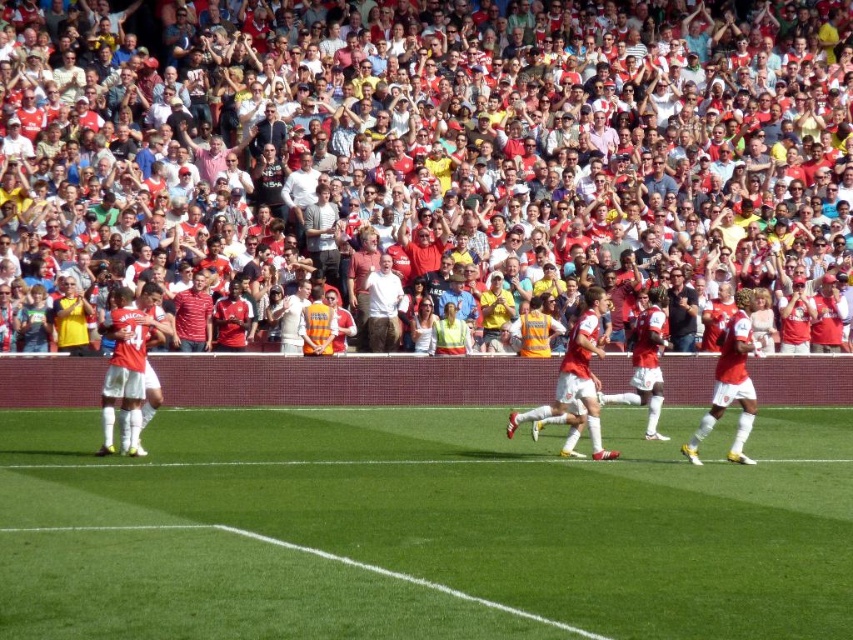
Question: Where is red jersey fans at center located in relation to matte red jersey at right in the image?

Choices:
 (A) right
 (B) left

Answer: (B)

Question: Which object is closer to the camera taking this photo?

Choices:
 (A) matte red jersey at right
 (B) green grass at center
 (C) red jersey fans at center

Answer: (B)

Question: Does red jersey fans at center have a greater width compared to green grass at center?

Choices:
 (A) no
 (B) yes

Answer: (B)

Question: Which object is positioned closest to the green grass at center?

Choices:
 (A) matte red jersey at right
 (B) red jersey fans at center

Answer: (A)

Question: Which object is positioned closest to the matte red jersey at right?

Choices:
 (A) red jersey fans at center
 (B) green grass at center

Answer: (B)

Question: Is green grass at center bigger than matte red jersey at right?

Choices:
 (A) yes
 (B) no

Answer: (A)